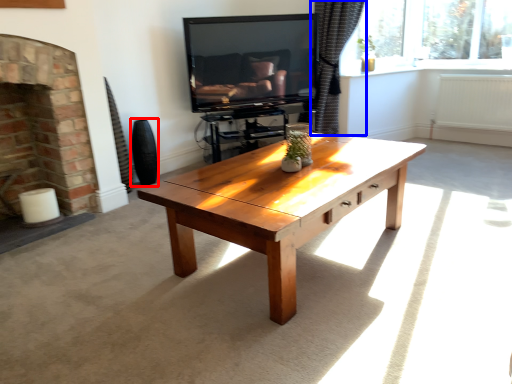
Question: Which object is further to the camera taking this photo, vase (highlighted by a red box) or curtain (highlighted by a blue box)?

Choices:
 (A) vase
 (B) curtain

Answer: (B)